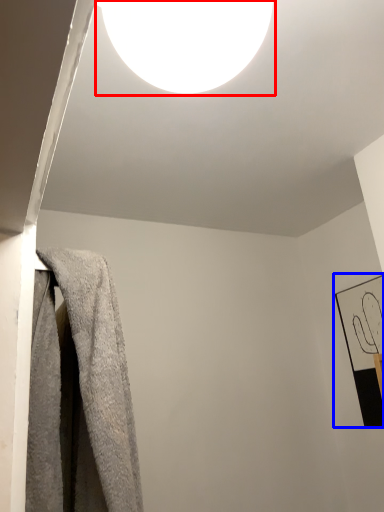
Question: Which of the following is the closest to the observer, lamp (highlighted by a red box) or picture frame (highlighted by a blue box)?

Choices:
 (A) lamp
 (B) picture frame

Answer: (A)